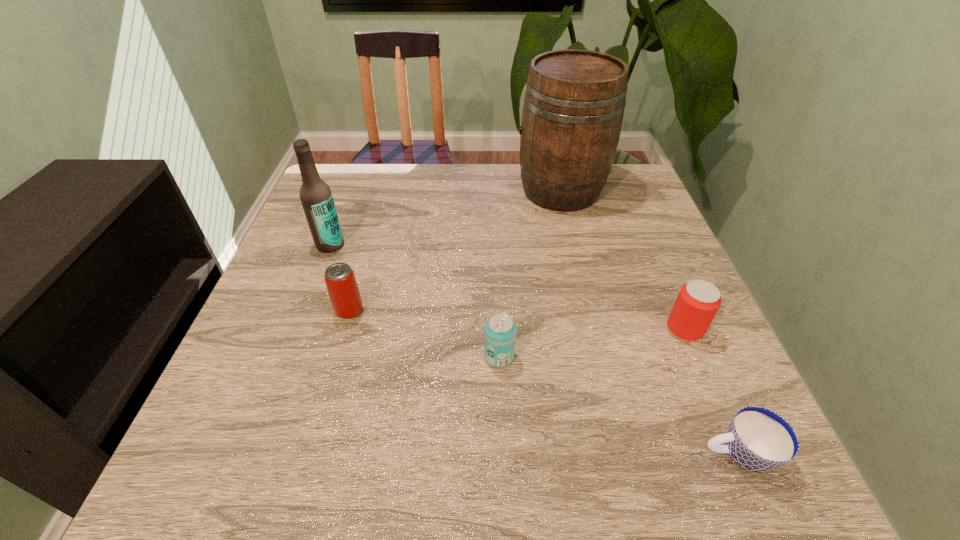
Find the location of a particular element. vacant area located 0.240m on the side of the cider near the bung hole is located at coordinates [431, 190].

You are a GUI agent. You are given a task and a screenshot of the screen. Output one action in this format:
    pyautogui.click(x=<x>, y=<y>)
    Task: Click on the vacant space situated on the side of the cider near the bung hole
    This screenshot has width=960, height=540.
    Given the screenshot: What is the action you would take?
    pyautogui.click(x=452, y=190)

Where is `free space located on the side of the cider near the bung hole`? The width and height of the screenshot is (960, 540). free space located on the side of the cider near the bung hole is located at coordinates (484, 190).

Find the location of a particular element. vacant region located 0.250m on the side of the beer bottle with the label is located at coordinates (296, 337).

I want to click on vacant region located on the right of the fifth object from right to left, so click(x=444, y=310).

Where is `free space located 0.320m on the back of the rightmost beer can`? free space located 0.320m on the back of the rightmost beer can is located at coordinates (638, 222).

This screenshot has height=540, width=960. Identify the location of free spot located 0.170m on the front of the third object from left to right. (503, 460).

Find the location of a particular element. free space located on the side of the cup with the handle is located at coordinates (456, 454).

The image size is (960, 540). Find the location of `blank area located 0.360m on the side of the cup with the handle`. blank area located 0.360m on the side of the cup with the handle is located at coordinates (474, 454).

Locate an element on the screen. The height and width of the screenshot is (540, 960). vacant space located 0.170m on the side of the cup with the handle is located at coordinates (594, 454).